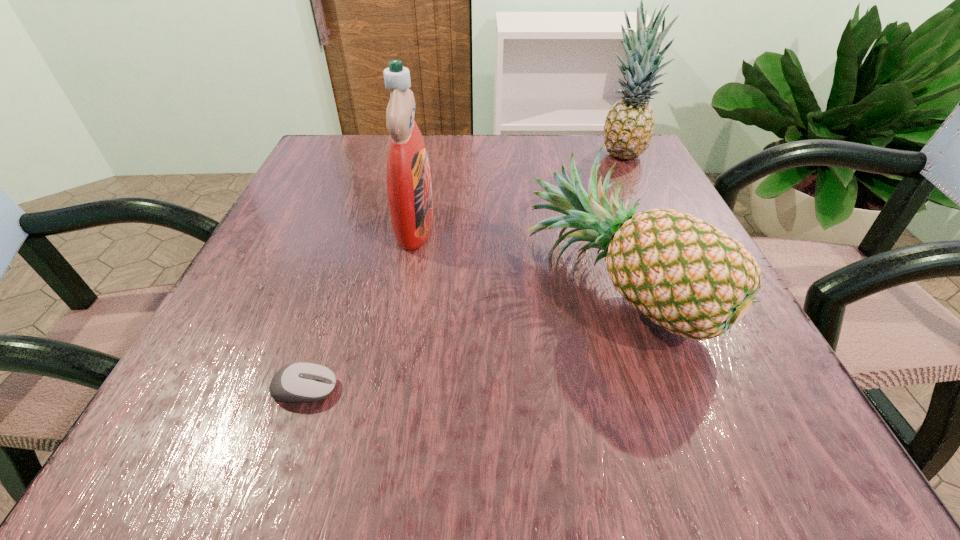
In order to click on vacant space located 0.390m on the wheel side of the shortest object in this screenshot , I will do `click(648, 389)`.

Where is `object located in the far edge section of the desktop`? object located in the far edge section of the desktop is located at coordinates (629, 124).

This screenshot has height=540, width=960. I want to click on object located in the near edge section of the desktop, so click(x=298, y=382).

The image size is (960, 540). I want to click on object at the left edge, so click(298, 382).

This screenshot has height=540, width=960. Find the location of `object that is at the near left corner`. object that is at the near left corner is located at coordinates (298, 382).

Locate an element on the screen. This screenshot has width=960, height=540. object that is at the far right corner is located at coordinates (629, 124).

The width and height of the screenshot is (960, 540). Identify the location of vacant space at the far edge of the desktop. (466, 140).

Locate an element on the screen. The image size is (960, 540). free spot at the near edge of the desktop is located at coordinates [464, 394].

Identify the location of free space at the far left corner of the desktop. Image resolution: width=960 pixels, height=540 pixels. (351, 145).

You are a GUI agent. You are given a task and a screenshot of the screen. Output one action in this format:
    pyautogui.click(x=<x>, y=<y>)
    Task: Click on the free region at the near left corner
    The image size is (960, 540).
    Given the screenshot: What is the action you would take?
    pyautogui.click(x=171, y=398)